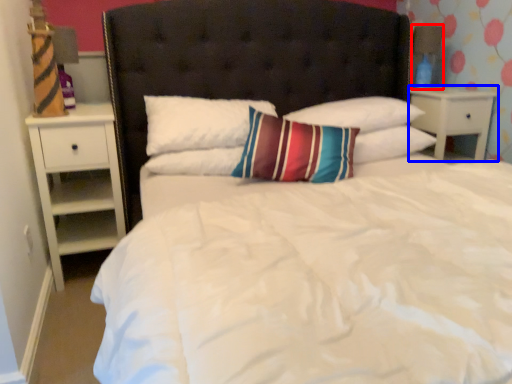
Question: Among these objects, which one is farthest to the camera, lamp (highlighted by a red box) or nightstand (highlighted by a blue box)?

Choices:
 (A) lamp
 (B) nightstand

Answer: (A)